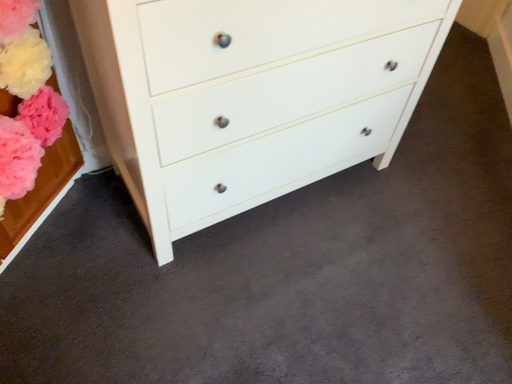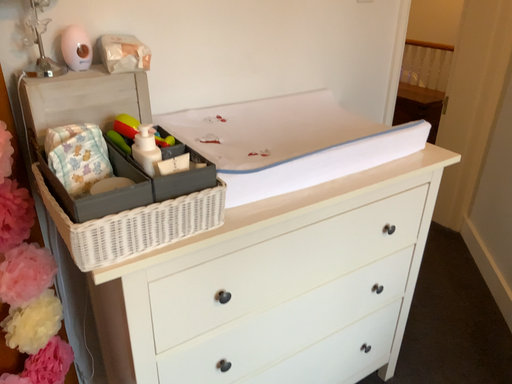
Question: Which way did the camera rotate in the video?

Choices:
 (A) rotated downward
 (B) rotated upward

Answer: (B)